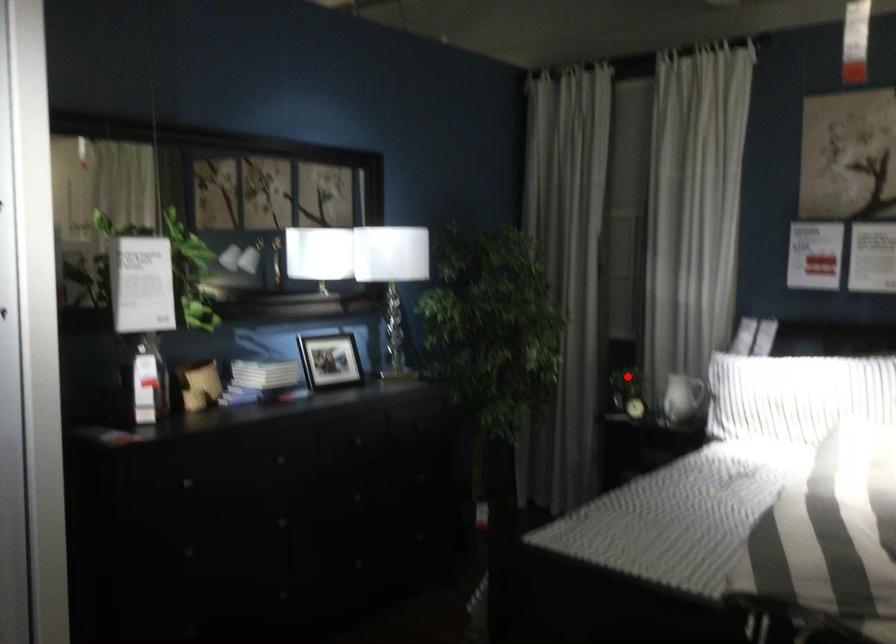
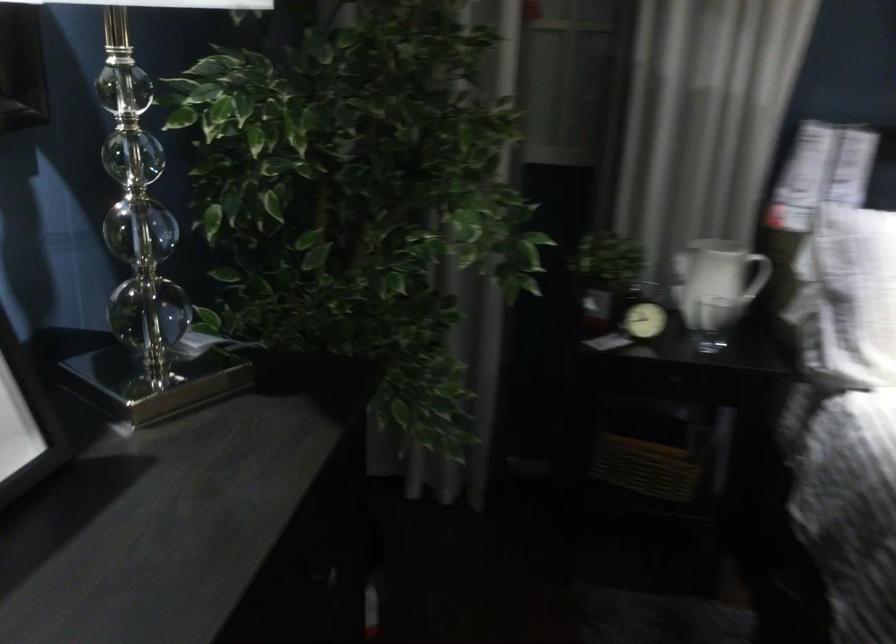
Question: I am providing you with two images of the same scene from different viewpoints. Image1 has a red point marked. In image2, the corresponding 3D location appears at what relative position? Reply with the corresponding letter.

Choices:
 (A) Closer
 (B) Farther

Answer: (A)